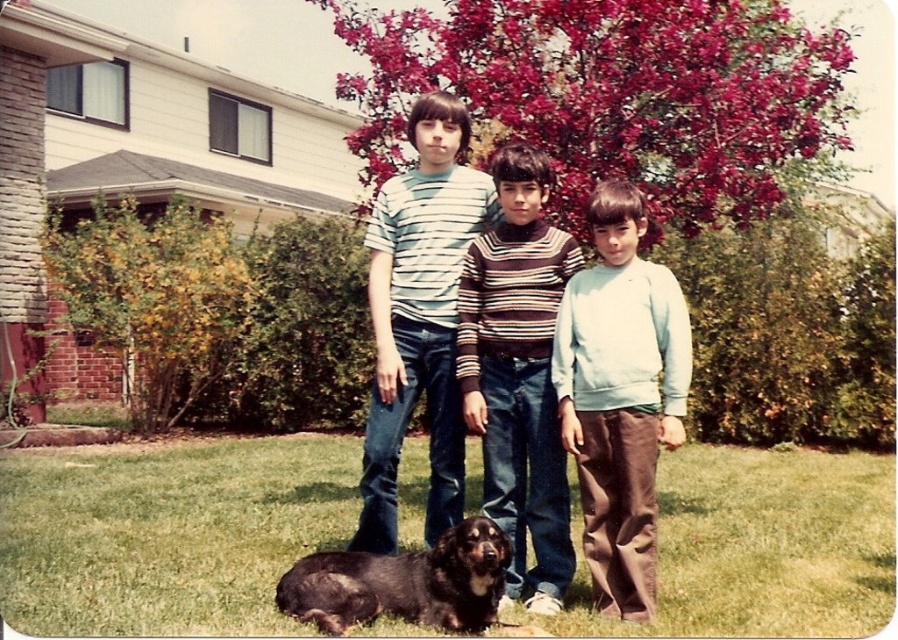
Question: Which of the following is the farthest from the observer?

Choices:
 (A) (675, 312)
 (B) (163, 604)
 (C) (392, 397)
 (D) (367, 572)

Answer: (C)

Question: Is striped sweater at center bigger than black shaggy dog at lower center?

Choices:
 (A) yes
 (B) no

Answer: (A)

Question: Does green grass at lower center appear over striped sweater at center?

Choices:
 (A) yes
 (B) no

Answer: (B)

Question: Is green grass at lower center smaller than light blue sweater at center?

Choices:
 (A) yes
 (B) no

Answer: (B)

Question: Which of the following is the farthest from the observer?

Choices:
 (A) striped cotton shirt at center
 (B) black shaggy dog at lower center
 (C) green grass at lower center
 (D) light blue sweater at center

Answer: (A)

Question: Among these points, which one is nearest to the camera?

Choices:
 (A) (643, 419)
 (B) (530, 296)

Answer: (A)